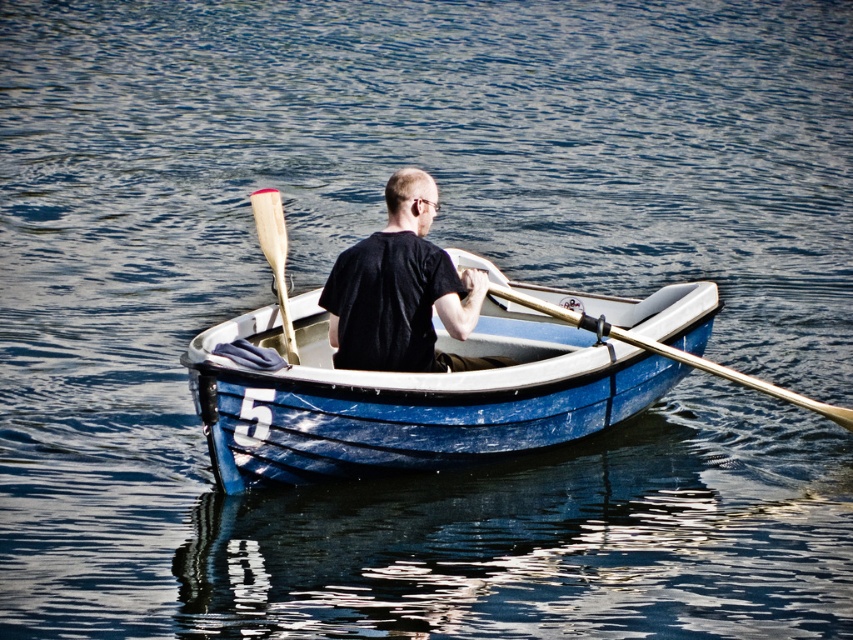
You are standing on a dock and see the blue polished wood canoe at center in the water. If you want to throw a lifebuoy to the canoe, will it land within 80 feet from you?

The blue polished wood canoe at center and camera are 77.05 feet apart, so yes, the lifebuoy will land within 80 feet from you.

You are standing on the shore and see two points marked on the boat. Which point is closer to you, point [358,246] or point [584,321]?

Point [358,246] is closer to you than point [584,321].

You are standing on the dock and see two points marked on the water surface near the boat. The points are labeled as point 1 at coordinates point (238, 484) and point 2 at coordinates point (393, 196). Which point is closer to you?

Point 1 at coordinates point (238, 484) is closer to you than point 2 at coordinates point (393, 196).